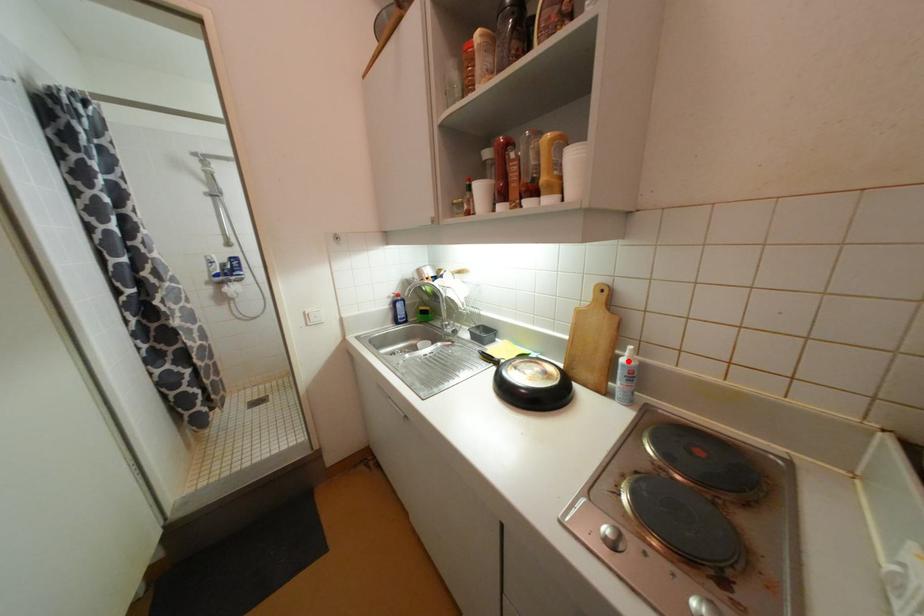
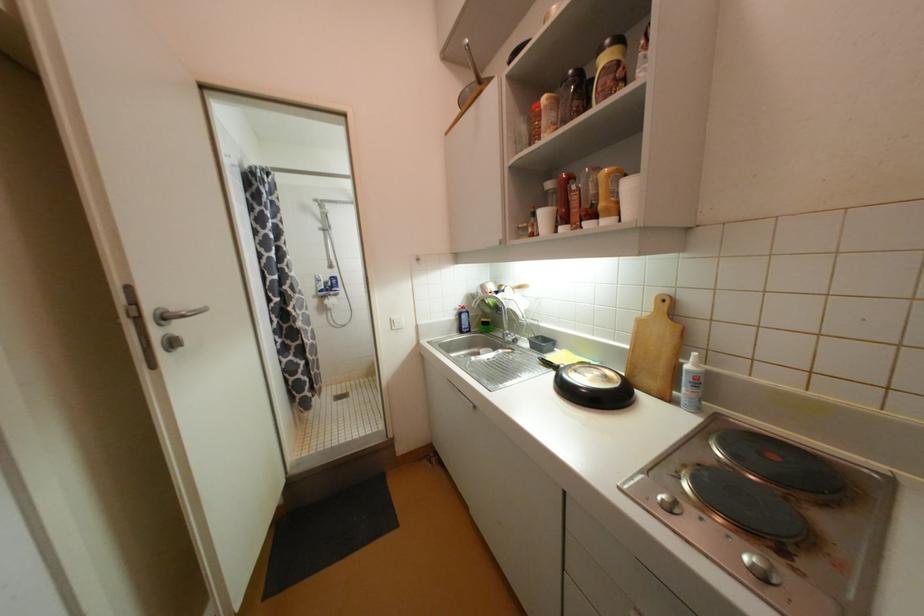
In the second image, find the point that corresponds to the highlighted location in the first image.

(693, 368)